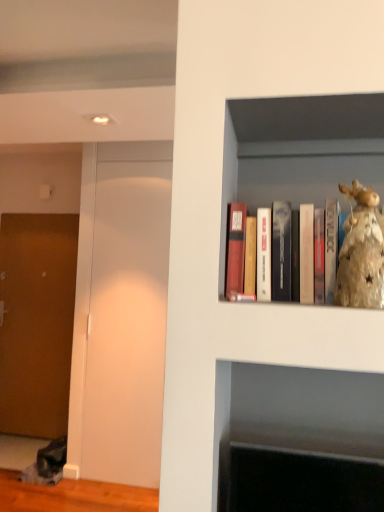
This screenshot has width=384, height=512. I want to click on free location in front of brown textured door at left, so click(x=18, y=451).